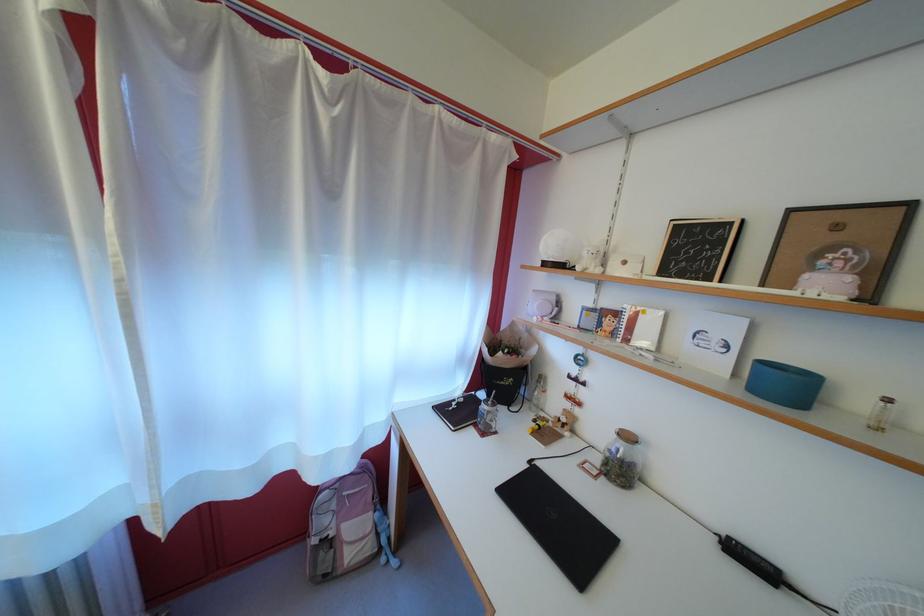
Where would you lift the pink backpack handle? Please return your answer as a coordinate pair (x, y).

(393, 562)